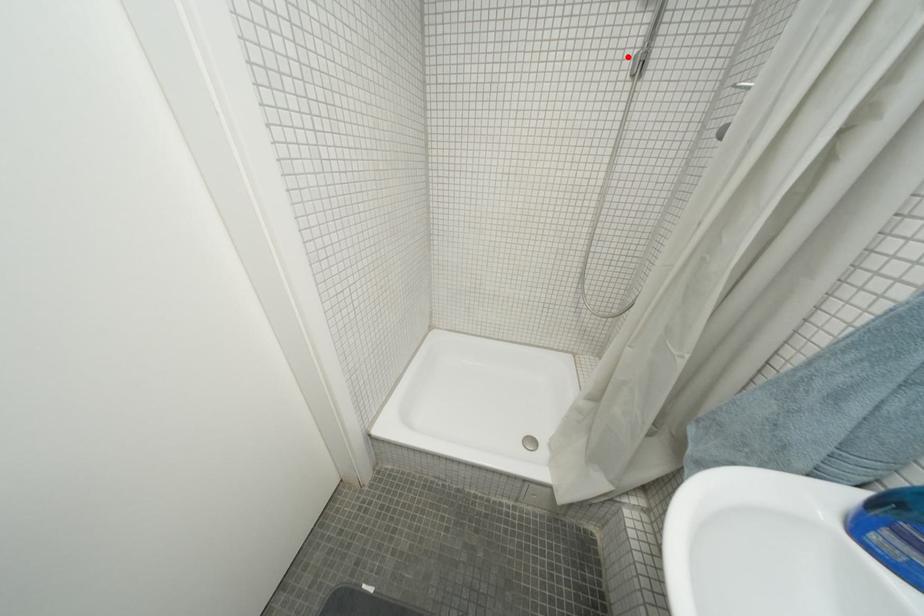
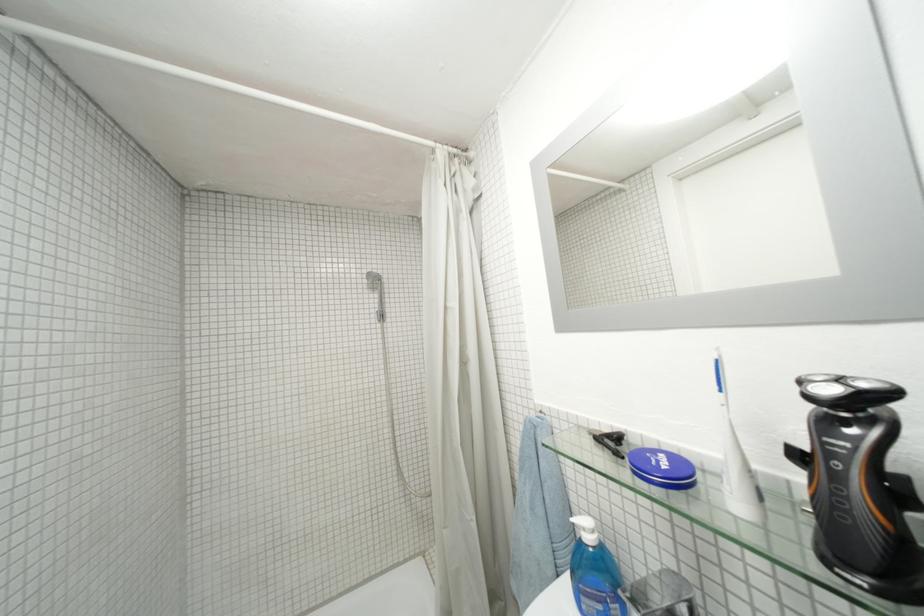
Find the pixel in the second image that matches the highlighted location in the first image.

(375, 314)